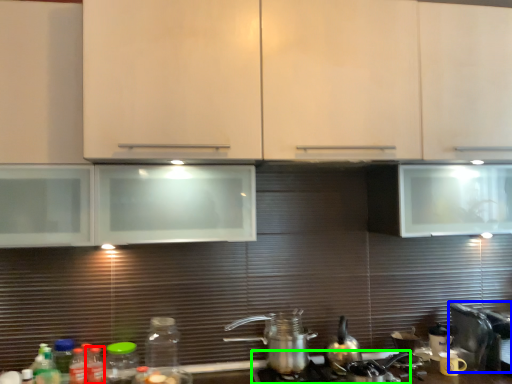
Question: Based on their relative distances, which object is nearer to bottle (highlighted by a red box)? Choose from appliance (highlighted by a blue box) and gas stove (highlighted by a green box).

Choices:
 (A) appliance
 (B) gas stove

Answer: (B)